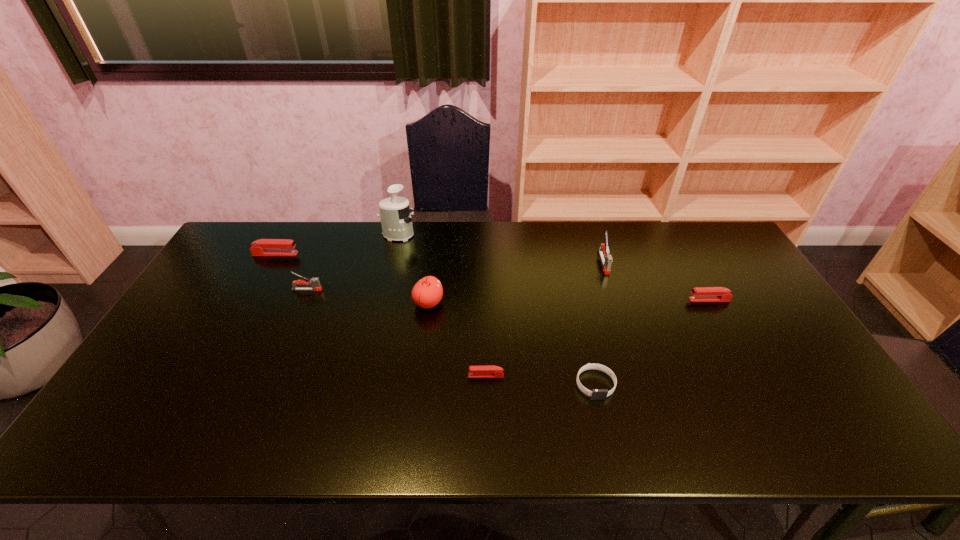
The height and width of the screenshot is (540, 960). In order to click on free space that is in between the fifth object from right to left and the wristband in this screenshot , I will do `click(512, 344)`.

Where is `free space between the fourth tallest object and the farthest object`? This screenshot has height=540, width=960. free space between the fourth tallest object and the farthest object is located at coordinates (352, 262).

This screenshot has height=540, width=960. Identify the location of free space between the farthest object and the fourth stapler from left to right. (501, 249).

The image size is (960, 540). I want to click on vacant region between the leftmost red stapler and the third stapler from right to left, so click(381, 315).

Where is `free spot between the second object from right to left and the second biggest red stapler`? The image size is (960, 540). free spot between the second object from right to left and the second biggest red stapler is located at coordinates (657, 281).

I want to click on blank region between the second biggest red stapler and the farthest object, so click(554, 267).

This screenshot has width=960, height=540. What are the coordinates of `the fourth closest object to the second red stapler from left to right` in the screenshot? It's located at (314, 282).

What are the coordinates of `object that can be found as the closest to the fourth stapler from left to right` in the screenshot? It's located at (699, 294).

The width and height of the screenshot is (960, 540). I want to click on stapler that is the fourth closest to the red apple, so click(606, 259).

Locate an element on the screen. stapler that stands as the closest to the fourth farthest object is located at coordinates (263, 247).